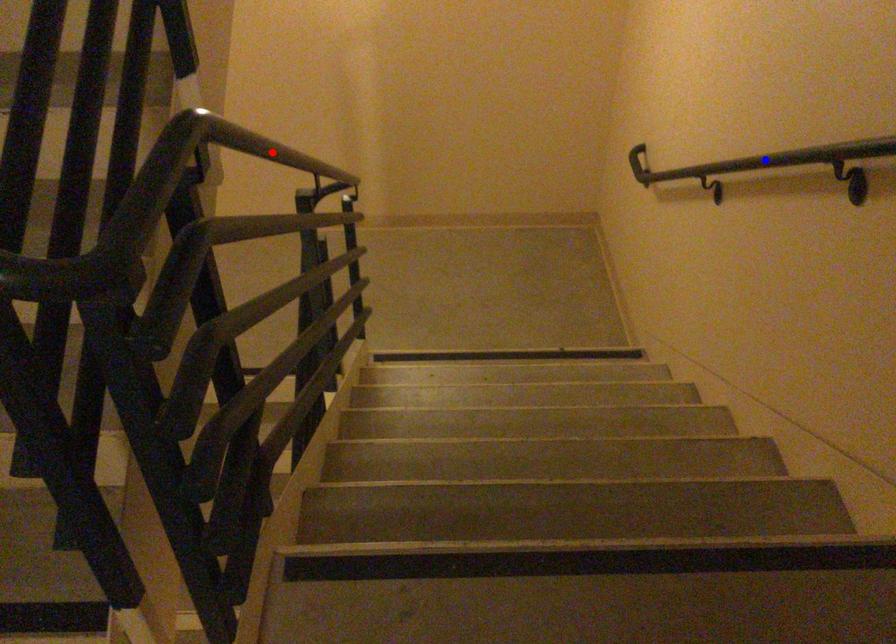
Question: In the image, two points are highlighted. Which point is nearer to the camera? Reply with the corresponding letter.

Choices:
 (A) blue point
 (B) red point

Answer: (B)